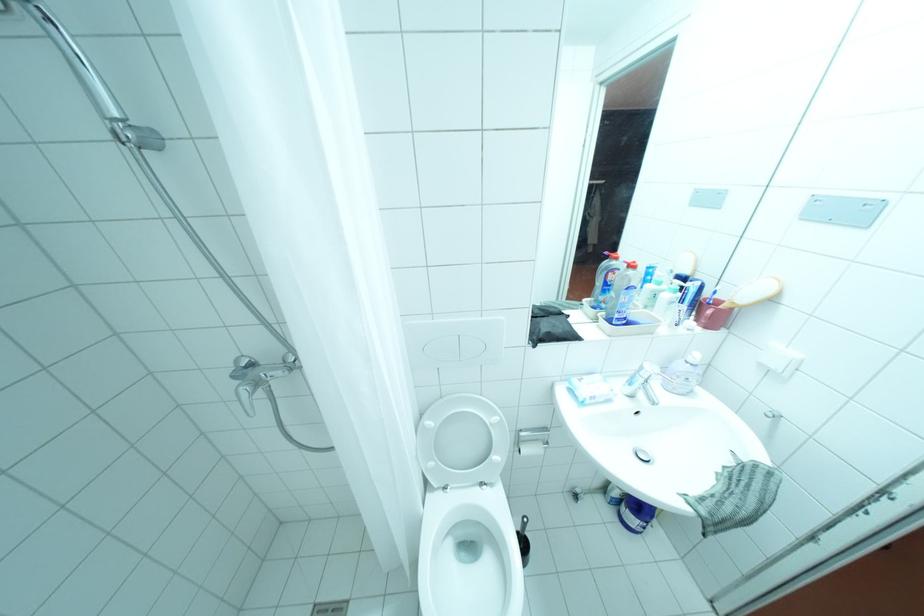
At what (x,y) coordinates should I click in order to perform the action: click on toilet brush handle. Please return your answer as a coordinate pair (x, y). Looking at the image, I should click on (466, 513).